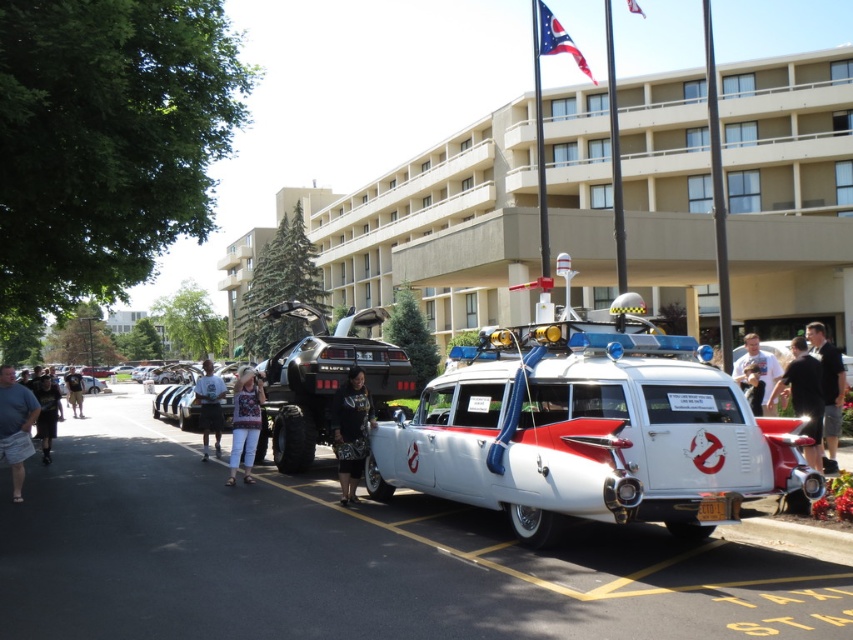
From the picture: Does dark blue denim jacket at center appear on the left side of white t-shirt at center?

Yes, dark blue denim jacket at center is to the left of white t-shirt at center.

This screenshot has height=640, width=853. What do you see at coordinates (350, 429) in the screenshot? I see `dark blue denim jacket at center` at bounding box center [350, 429].

This screenshot has width=853, height=640. Find the location of `dark blue denim jacket at center`. dark blue denim jacket at center is located at coordinates (350, 429).

How much distance is there between black fabric shirt at right and khaki shorts at center?

They are 93.17 feet apart.

Is black fabric shirt at right further to camera compared to khaki shorts at center?

No, black fabric shirt at right is in front of khaki shorts at center.

Identify the location of black fabric shirt at right. (804, 396).

Which is below, black fabric shirt at right or blue denim shorts at left?

black fabric shirt at right

Does black fabric shirt at right have a lesser height compared to blue denim shorts at left?

Incorrect, black fabric shirt at right's height does not fall short of blue denim shorts at left's.

Is point (799, 412) less distant than point (15, 435)?

Yes, point (799, 412) is closer to viewer.

Identify the location of black fabric shirt at right. (804, 396).